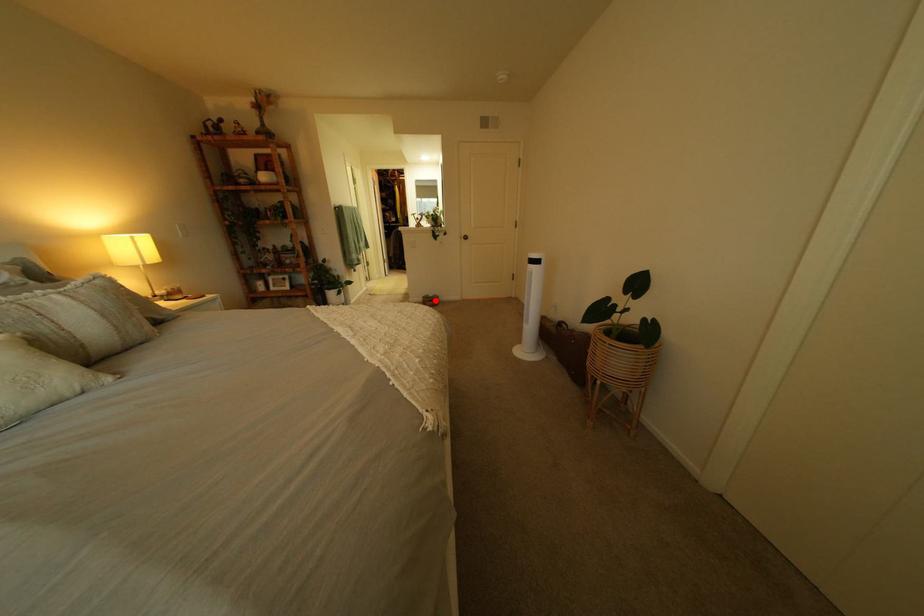
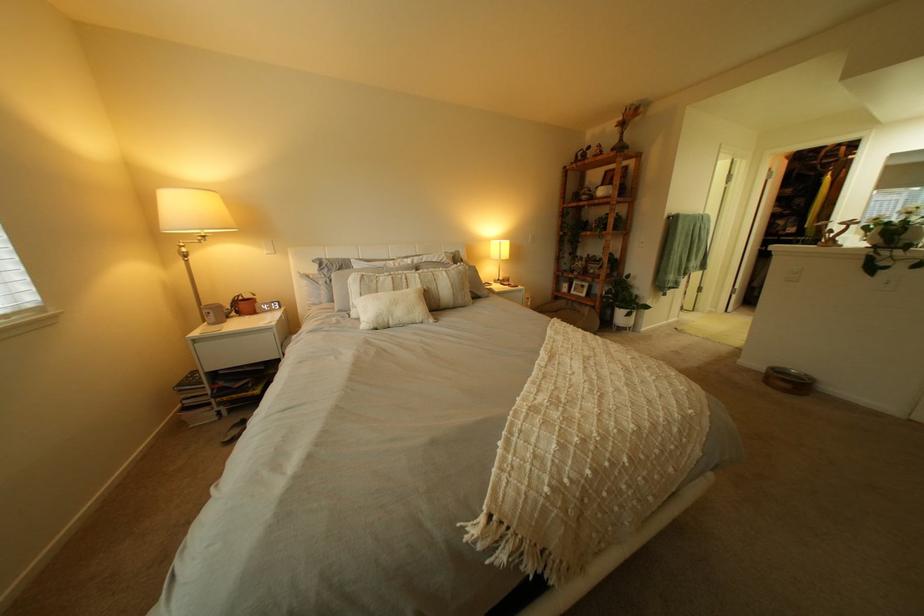
In the second image, find the point that corresponds to the highlighted location in the first image.

(779, 369)